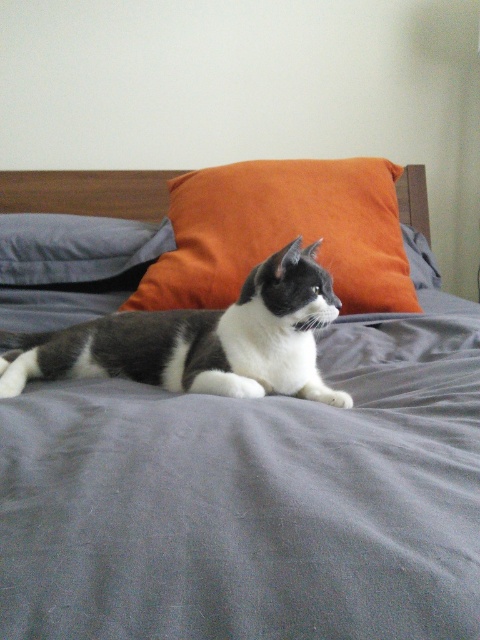
Can you confirm if orange fabric pillow at center is taller than matte gray pillow at left?

Yes.

Does orange fabric pillow at center appear on the left side of matte gray pillow at left?

In fact, orange fabric pillow at center is to the right of matte gray pillow at left.

Where is `orange fabric pillow at center`? The height and width of the screenshot is (640, 480). orange fabric pillow at center is located at coordinates (282, 232).

Is point (427, 584) closer to camera compared to point (230, 339)?

Yes, point (427, 584) is closer to viewer.

Is point (31, 422) behind point (319, 291)?

No, (31, 422) is closer to viewer.

At what (x,y) coordinates should I click in order to perform the action: click on gray fabric bed at center. Please return your answer as a coordinate pair (x, y). Looking at the image, I should click on (253, 499).

Is point (348, 262) farther from camera compared to point (156, 376)?

Yes.

Between point (346, 232) and point (24, 349), which one is positioned in front?

Point (24, 349)

Between point (392, 292) and point (176, 381), which one is positioned in front?

Positioned in front is point (176, 381).

Where is `orange fabric pillow at center`? This screenshot has height=640, width=480. orange fabric pillow at center is located at coordinates coord(282,232).